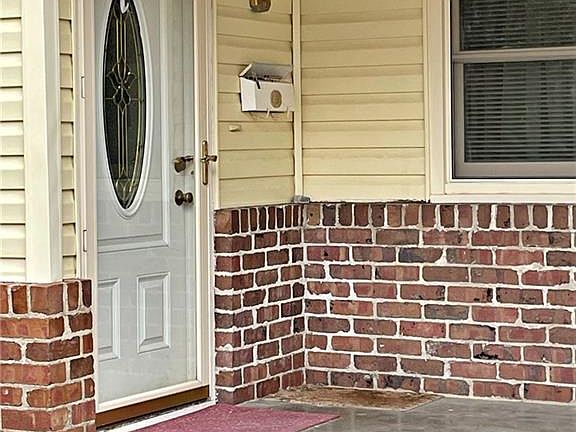
Locate an element on the screen. This screenshot has width=576, height=432. blinds is located at coordinates (513, 119).